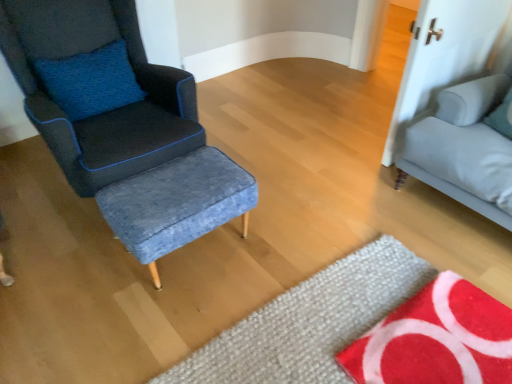
Question: From the image's perspective, is light gray fabric studio couch at right located beneath textured wool mat at lower center, positioned as the 1th mat in left-to-right order?

Choices:
 (A) no
 (B) yes

Answer: (A)

Question: Is light gray fabric studio couch at right thinner than textured wool mat at lower center, positioned as the 1th mat in left-to-right order?

Choices:
 (A) no
 (B) yes

Answer: (B)

Question: Is light gray fabric studio couch at right shorter than textured wool mat at lower center, positioned as the 1th mat in left-to-right order?

Choices:
 (A) yes
 (B) no

Answer: (B)

Question: Is light gray fabric studio couch at right to the right of textured wool mat at lower center, positioned as the 1th mat in left-to-right order, from the viewer's perspective?

Choices:
 (A) no
 (B) yes

Answer: (B)

Question: Is light gray fabric studio couch at right bigger than textured wool mat at lower center, positioned as the 2th mat in right-to-left order?

Choices:
 (A) no
 (B) yes

Answer: (B)

Question: Looking at the image, does textured wool mat at lower center, positioned as the 1th mat in left-to-right order, seem bigger or smaller compared to red textured mat at lower right, acting as the second mat starting from the left?

Choices:
 (A) small
 (B) big

Answer: (A)

Question: Does point (276, 316) appear closer or farther from the camera than point (508, 339)?

Choices:
 (A) closer
 (B) farther

Answer: (B)

Question: From a real-world perspective, is textured wool mat at lower center, positioned as the 1th mat in left-to-right order, above or below red textured mat at lower right, the first mat positioned from the right?

Choices:
 (A) above
 (B) below

Answer: (B)

Question: Based on their positions, is textured wool mat at lower center, positioned as the 2th mat in right-to-left order, located to the left or right of red textured mat at lower right, acting as the second mat starting from the left?

Choices:
 (A) left
 (B) right

Answer: (A)

Question: In the image, is matte blue fabric chair at left positioned in front of or behind denim fabric stool at center?

Choices:
 (A) behind
 (B) front

Answer: (B)

Question: In terms of height, does matte blue fabric chair at left look taller or shorter compared to denim fabric stool at center?

Choices:
 (A) tall
 (B) short

Answer: (A)

Question: Does point (7, 46) appear closer or farther from the camera than point (121, 236)?

Choices:
 (A) closer
 (B) farther

Answer: (B)

Question: Is matte blue fabric chair at left bigger or smaller than denim fabric stool at center?

Choices:
 (A) small
 (B) big

Answer: (B)

Question: From the image's perspective, relative to textured wool mat at lower center, positioned as the 2th mat in right-to-left order, is red textured mat at lower right, the first mat positioned from the right, above or below?

Choices:
 (A) above
 (B) below

Answer: (A)

Question: Is point (436, 359) closer or farther from the camera than point (290, 349)?

Choices:
 (A) closer
 (B) farther

Answer: (A)